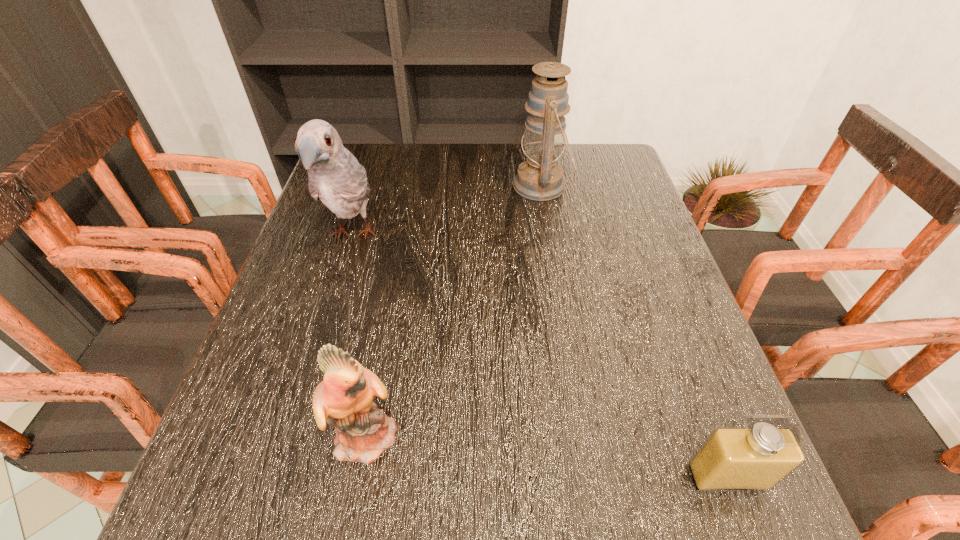
Where is `free space between the second object from right to left and the third tallest object`? free space between the second object from right to left and the third tallest object is located at coordinates coord(455,310).

The image size is (960, 540). I want to click on vacant point located between the farther parrot and the oil lamp, so click(447, 211).

Choose which object is the nearest neighbor to the oil lamp. Please provide its 2D coordinates. Your answer should be formatted as a tuple, i.e. [(x, y)], where the tuple contains the x and y coordinates of a point satisfying the conditions above.

[(335, 177)]

This screenshot has width=960, height=540. I want to click on the second closest object to the shortest object, so click(x=540, y=178).